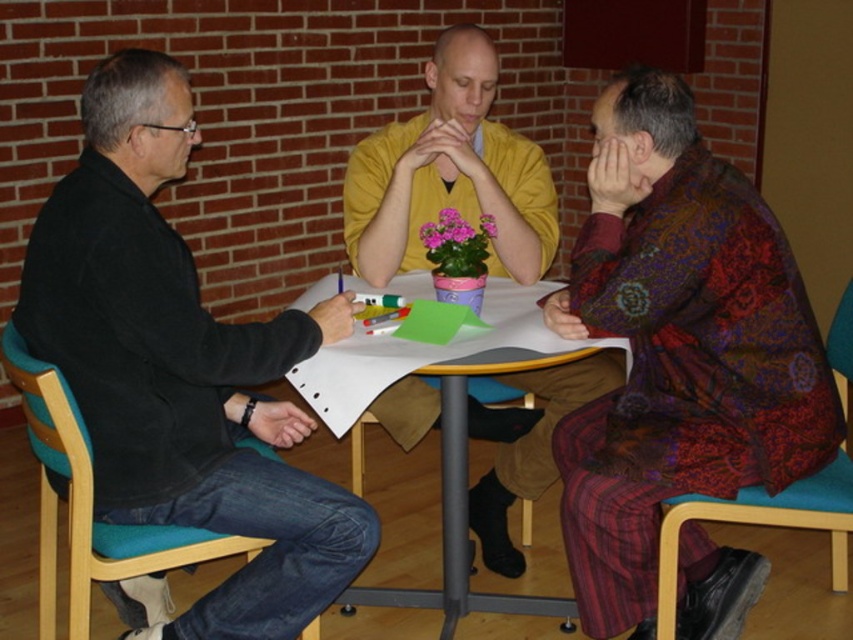
You are sitting at the teal wood chair at lower left and want to hand a document to the person wearing the patterned silk shirt at right. Can you reach them directly without moving from your seat?

The patterned silk shirt at right is to the right of the teal wood chair at lower left, so you can reach them directly without moving from your seat.

You are organizing a small event and need to know if the patterned silk shirt at right can fit into a storage box designed for items no larger than the teal wood chair at lower left. Can it fit?

The patterned silk shirt at right has a smaller size compared to the teal wood chair at lower left, so it can fit into the storage box designed for items no larger than the teal wood chair at lower left.

You are standing in front of the table and want to pick up the item closest to you. Which point should you reach for, point 1 at coordinates point (339,557) or point 2 at coordinates point (843,525)?

You should reach for point 1 at coordinates point (339,557) because it is closer to the camera than point 2 at coordinates point (843,525).